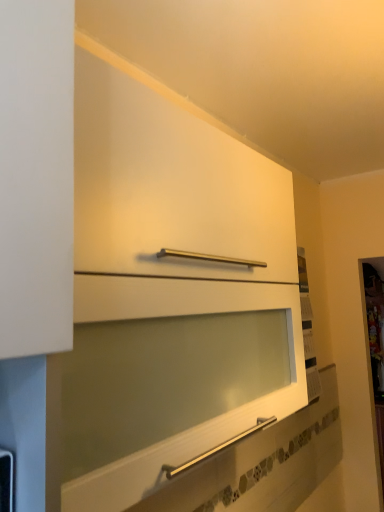
What do you see at coordinates (168, 294) in the screenshot? This screenshot has width=384, height=512. I see `white matte cabinet at center` at bounding box center [168, 294].

Find the location of a particular element. Image resolution: width=384 pixels, height=512 pixels. white matte cabinet at center is located at coordinates (168, 294).

Measure the distance between point [276,208] and camera.

They are 1.21 meters apart.

I want to click on white matte cabinet at center, so click(168, 294).